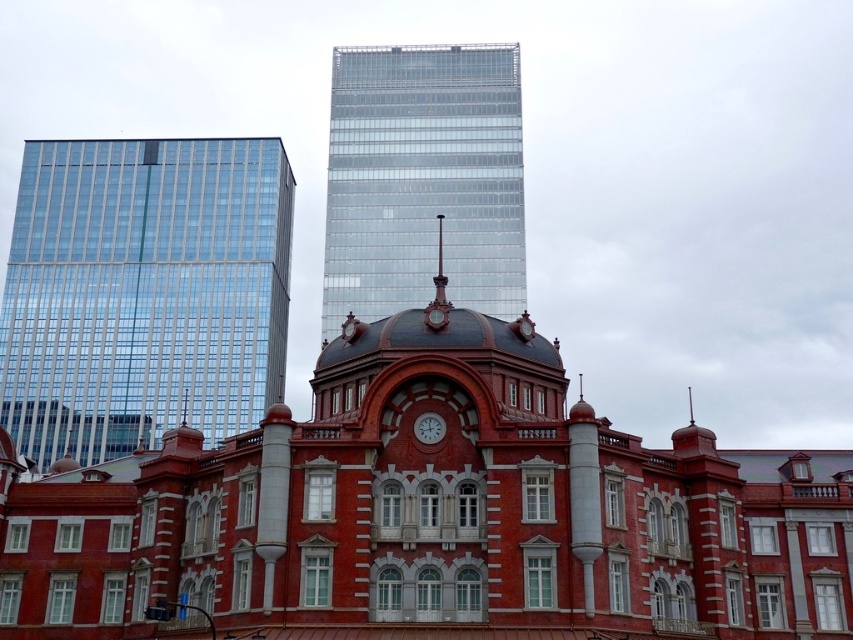
Does transparent glass skyscraper at upper left appear on the left side of transparent glass skyscraper at upper center?

Indeed, transparent glass skyscraper at upper left is positioned on the left side of transparent glass skyscraper at upper center.

Who is taller, transparent glass skyscraper at upper left or transparent glass skyscraper at upper center?

transparent glass skyscraper at upper center is taller.

Between point (125, 228) and point (352, 285), which one is positioned behind?

The point (125, 228) is behind.

This screenshot has width=853, height=640. What are the coordinates of `transparent glass skyscraper at upper left` in the screenshot? It's located at pos(143,292).

Consider the image. Is transparent glass skyscraper at upper center wider than matte red clock at center?

Yes, transparent glass skyscraper at upper center is wider than matte red clock at center.

Locate an element on the screen. The height and width of the screenshot is (640, 853). transparent glass skyscraper at upper center is located at coordinates (422, 179).

Where is `transparent glass skyscraper at upper center`? The image size is (853, 640). transparent glass skyscraper at upper center is located at coordinates (422, 179).

Which is above, transparent glass skyscraper at upper left or matte red clock at center?

Positioned higher is transparent glass skyscraper at upper left.

Looking at this image, between transparent glass skyscraper at upper left and matte red clock at center, which one appears on the left side from the viewer's perspective?

transparent glass skyscraper at upper left

Which is behind, point (47, 285) or point (419, 429)?

Point (47, 285)

Locate an element on the screen. transparent glass skyscraper at upper left is located at coordinates (143, 292).